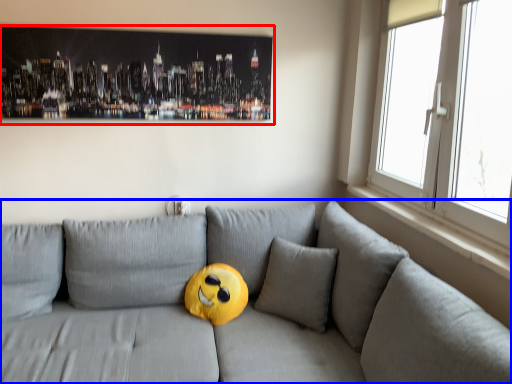
Question: Which object is further to the camera taking this photo, picture frame (highlighted by a red box) or studio couch (highlighted by a blue box)?

Choices:
 (A) picture frame
 (B) studio couch

Answer: (A)